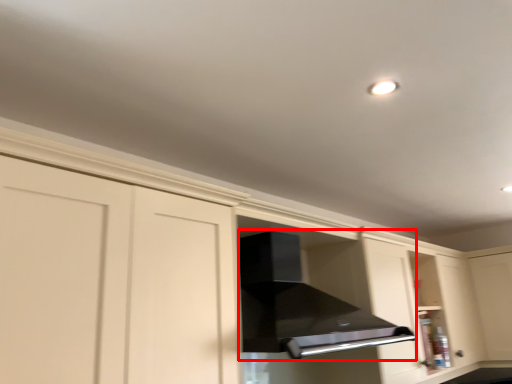
Question: Considering the relative positions of vent (annotated by the red box) and glass door in the image provided, where is vent (annotated by the red box) located with respect to the staircase?

Choices:
 (A) left
 (B) right

Answer: (A)